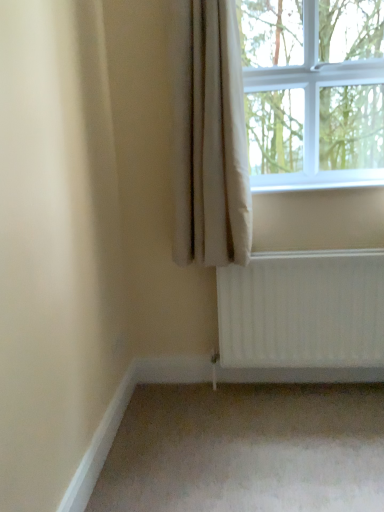
Question: From the image's perspective, is beige fabric curtain at upper right below clear glass window at upper right?

Choices:
 (A) yes
 (B) no

Answer: (A)

Question: Does beige fabric curtain at upper right lie in front of clear glass window at upper right?

Choices:
 (A) yes
 (B) no

Answer: (A)

Question: From a real-world perspective, is beige fabric curtain at upper right on clear glass window at upper right?

Choices:
 (A) no
 (B) yes

Answer: (A)

Question: From a real-world perspective, does beige fabric curtain at upper right sit lower than clear glass window at upper right?

Choices:
 (A) no
 (B) yes

Answer: (B)

Question: Is beige fabric curtain at upper right directly adjacent to clear glass window at upper right?

Choices:
 (A) yes
 (B) no

Answer: (B)

Question: Considering the relative positions of beige fabric curtain at upper right and clear glass window at upper right in the image provided, is beige fabric curtain at upper right to the left of clear glass window at upper right from the viewer's perspective?

Choices:
 (A) no
 (B) yes

Answer: (B)

Question: Does clear glass window at upper right have a lesser width compared to beige fabric curtain at upper right?

Choices:
 (A) no
 (B) yes

Answer: (A)

Question: Is clear glass window at upper right at the right side of beige fabric curtain at upper right?

Choices:
 (A) no
 (B) yes

Answer: (B)

Question: Is beige fabric curtain at upper right surrounded by clear glass window at upper right?

Choices:
 (A) no
 (B) yes

Answer: (A)

Question: Does clear glass window at upper right have a lesser height compared to beige fabric curtain at upper right?

Choices:
 (A) yes
 (B) no

Answer: (A)

Question: Is clear glass window at upper right positioned before beige fabric curtain at upper right?

Choices:
 (A) yes
 (B) no

Answer: (B)

Question: Is clear glass window at upper right at the left side of beige fabric curtain at upper right?

Choices:
 (A) yes
 (B) no

Answer: (B)

Question: Considering the relative positions of clear glass window at upper right and beige fabric curtain at upper right in the image provided, is clear glass window at upper right to the left or to the right of beige fabric curtain at upper right?

Choices:
 (A) right
 (B) left

Answer: (A)